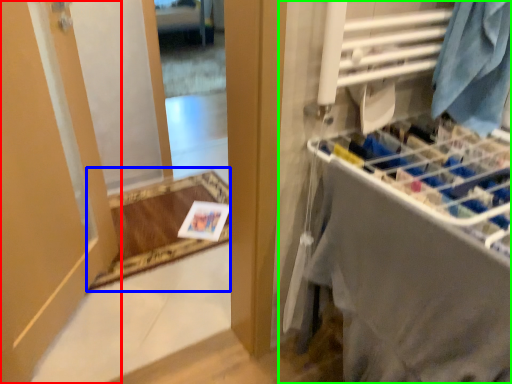
Question: Considering the real-world distances, which object is farthest from door (highlighted by a red box)? mat (highlighted by a blue box) or closet (highlighted by a green box)?

Choices:
 (A) mat
 (B) closet

Answer: (B)